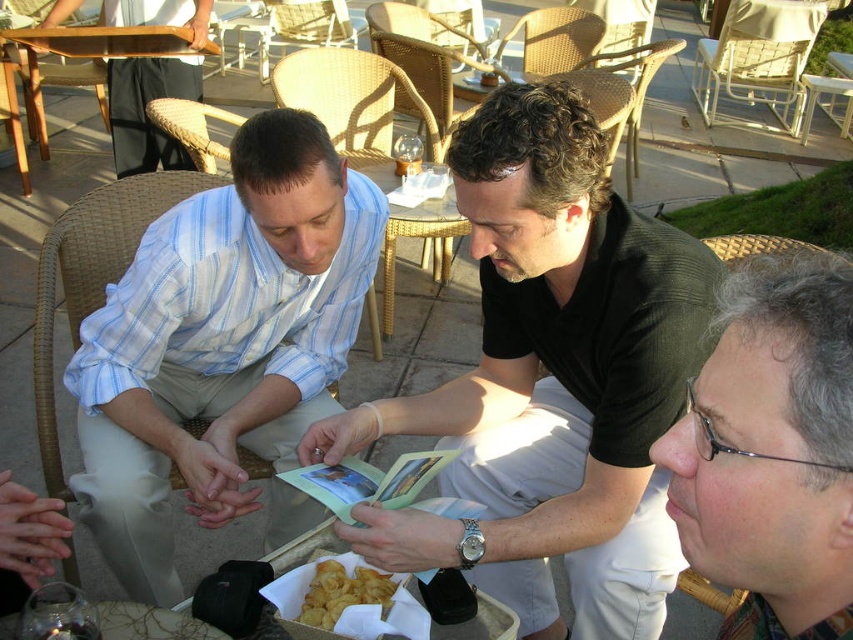
Who is more forward, (321, 588) or (96, 93)?

Positioned in front is point (321, 588).

Does golden crispy chips at lower center appear over brown wicker chair at upper left?

No, golden crispy chips at lower center is not above brown wicker chair at upper left.

What do you see at coordinates (343, 593) in the screenshot? The width and height of the screenshot is (853, 640). I see `golden crispy chips at lower center` at bounding box center [343, 593].

At what (x,y) coordinates should I click in order to perform the action: click on golden crispy chips at lower center. Please return your answer as a coordinate pair (x, y). Image resolution: width=853 pixels, height=640 pixels. Looking at the image, I should click on (343, 593).

Between wicker chair at upper right and golden crispy chips at lower center, which one has less height?

Standing shorter between the two is golden crispy chips at lower center.

Can you confirm if wicker chair at upper right is bigger than golden crispy chips at lower center?

Correct, wicker chair at upper right is larger in size than golden crispy chips at lower center.

Where is `wicker chair at upper right`? The height and width of the screenshot is (640, 853). wicker chair at upper right is located at coordinates (758, 60).

Describe the element at coordinates (772, 451) in the screenshot. The height and width of the screenshot is (640, 853). I see `gray textured hair at lower right` at that location.

Between point (752, 512) and point (305, 612), which one is positioned in front?

Positioned in front is point (752, 512).

Is point (724, 353) positioned after point (309, 605)?

No, it is not.

What are the coordinates of `gray textured hair at lower right` in the screenshot? It's located at point(772,451).